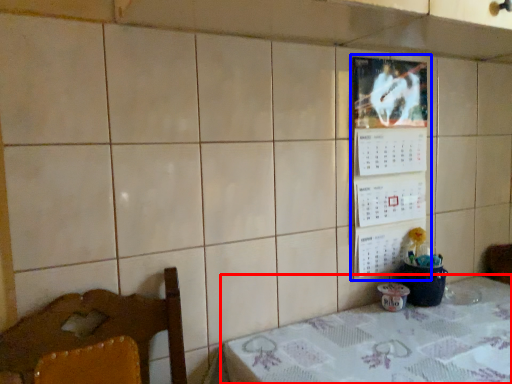
Question: Which object appears farthest to the camera in this image, table (highlighted by a red box) or bulletin board (highlighted by a blue box)?

Choices:
 (A) table
 (B) bulletin board

Answer: (B)